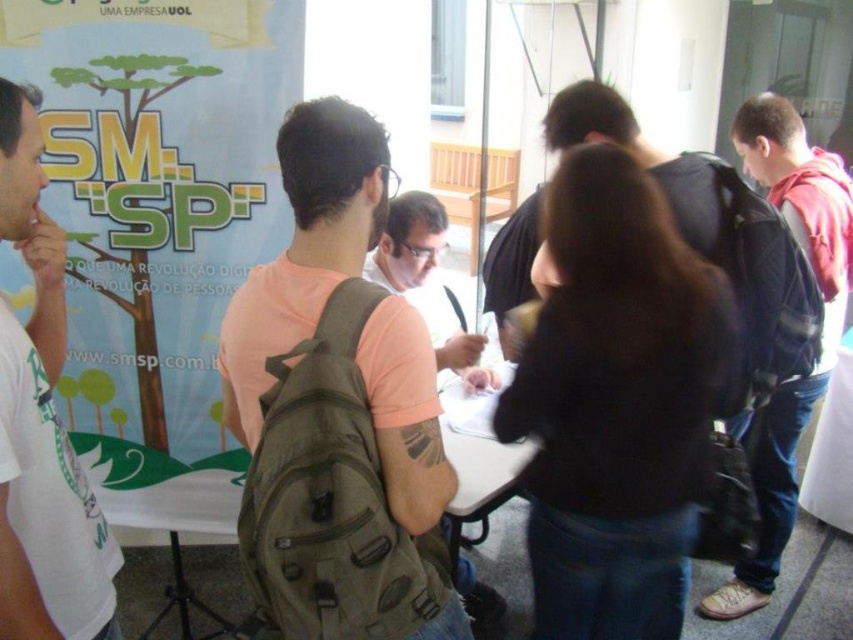
Which is below, black matte backpack at center or white t-shirt at left?

Positioned lower is black matte backpack at center.

Measure the distance between point (641, 212) and camera.

They are 1.34 meters apart.

This screenshot has height=640, width=853. Find the location of `black matte backpack at center`. black matte backpack at center is located at coordinates (618, 403).

Can you confirm if dark blue jeans at center is thinner than dark green backpack at right?

No.

From the picture: Is dark blue jeans at center taller than dark green backpack at right?

Correct, dark blue jeans at center is much taller as dark green backpack at right.

What do you see at coordinates (822, 324) in the screenshot? I see `dark blue jeans at center` at bounding box center [822, 324].

The image size is (853, 640). Identify the location of dark blue jeans at center. (822, 324).

Based on the photo, is olive green canvas backpack at center bigger than dark green backpack at right?

No.

Who is shorter, olive green canvas backpack at center or dark green backpack at right?

olive green canvas backpack at center is shorter.

Is point (347, 362) farther from viewer compared to point (780, 358)?

That is False.

Where is `olive green canvas backpack at center`? olive green canvas backpack at center is located at coordinates (331, 497).